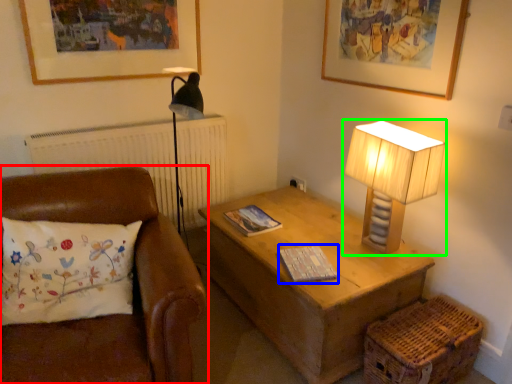
Question: Which object is the farthest from studio couch (highlighted by a red box)? Choose among these: magazine (highlighted by a blue box) or lamp (highlighted by a green box).

Choices:
 (A) magazine
 (B) lamp

Answer: (B)